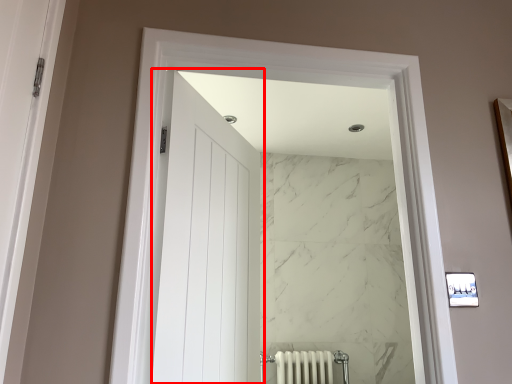
Question: Considering the relative positions of door (annotated by the red box) and window in the image provided, where is door (annotated by the red box) located with respect to the staircase?

Choices:
 (A) left
 (B) right

Answer: (A)